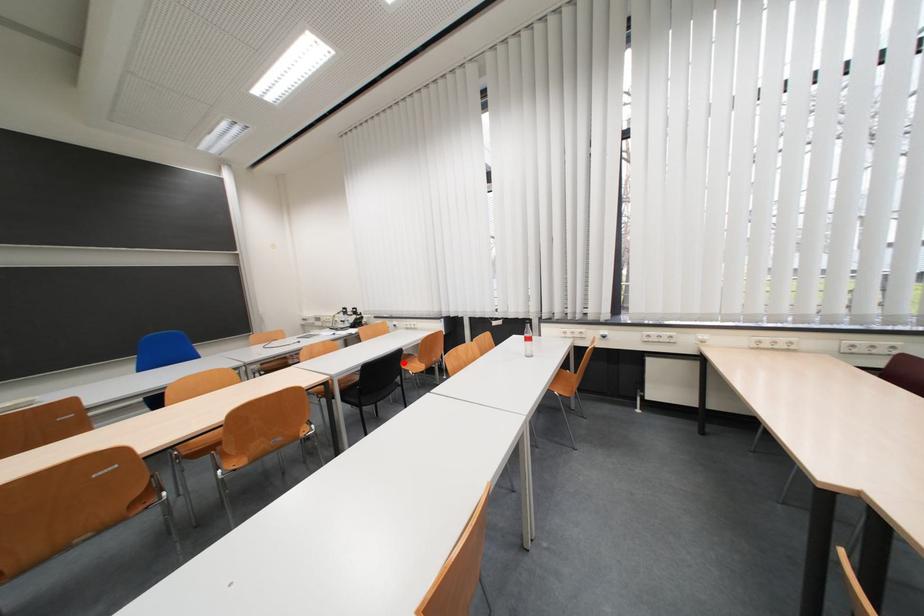
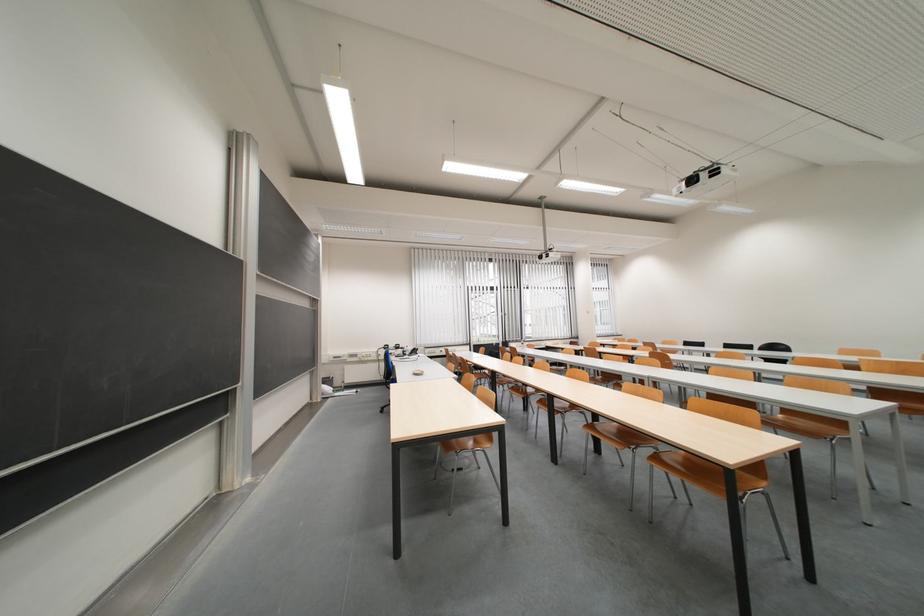
Question: I am providing you with two images of the same scene from different viewpoints. A red point is marked on the first image. Is the red point's position out of view in image 2?

Choices:
 (A) Yes
 (B) No

Answer: (A)